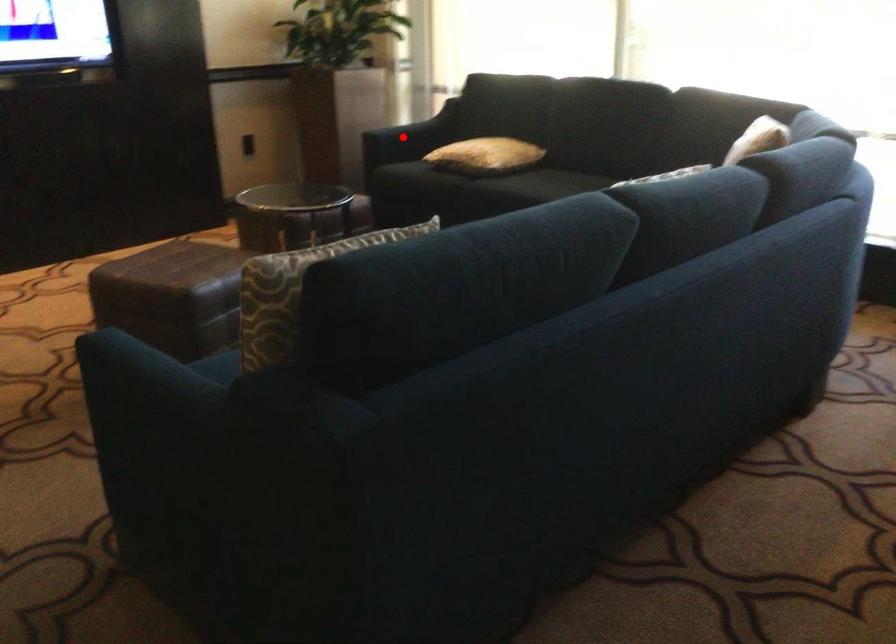
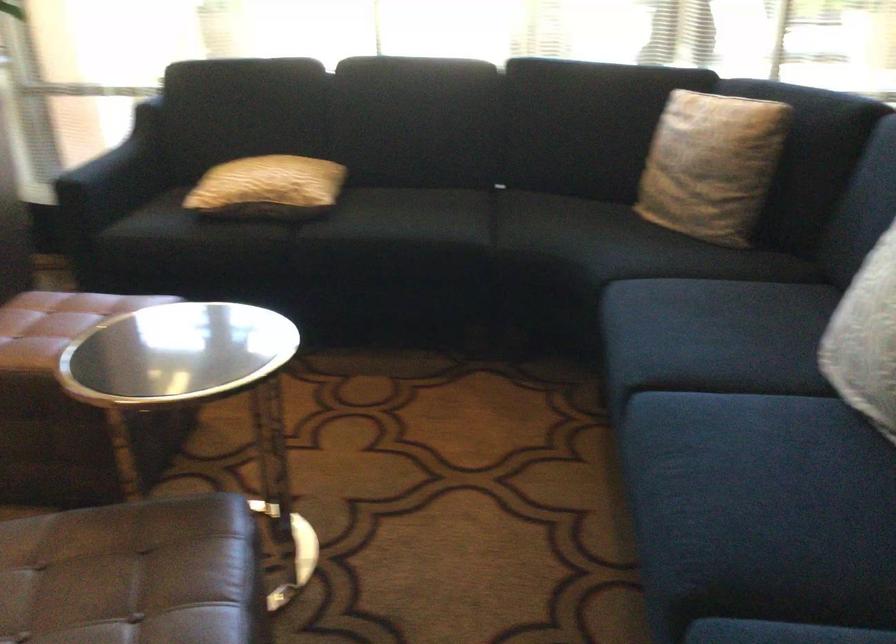
Where in the second image is the point corresponding to the highlighted location from the first image?

(115, 176)